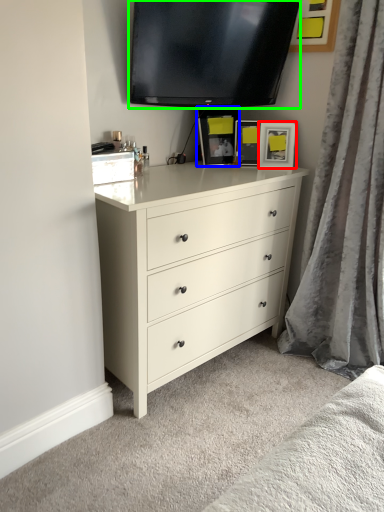
Question: Considering the real-world distances, which object is farthest from picture frame (highlighted by a red box)? picture frame (highlighted by a blue box) or television (highlighted by a green box)?

Choices:
 (A) picture frame
 (B) television

Answer: (B)